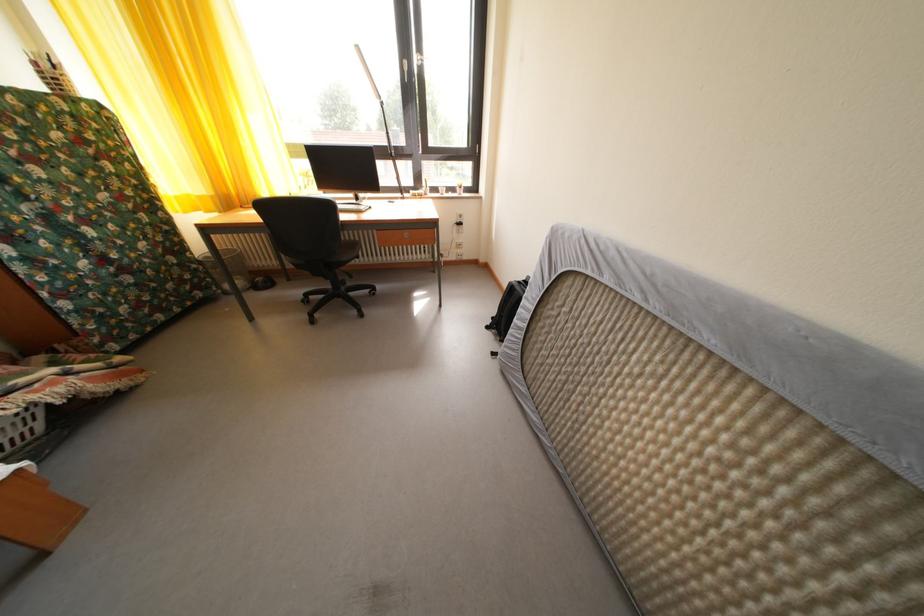
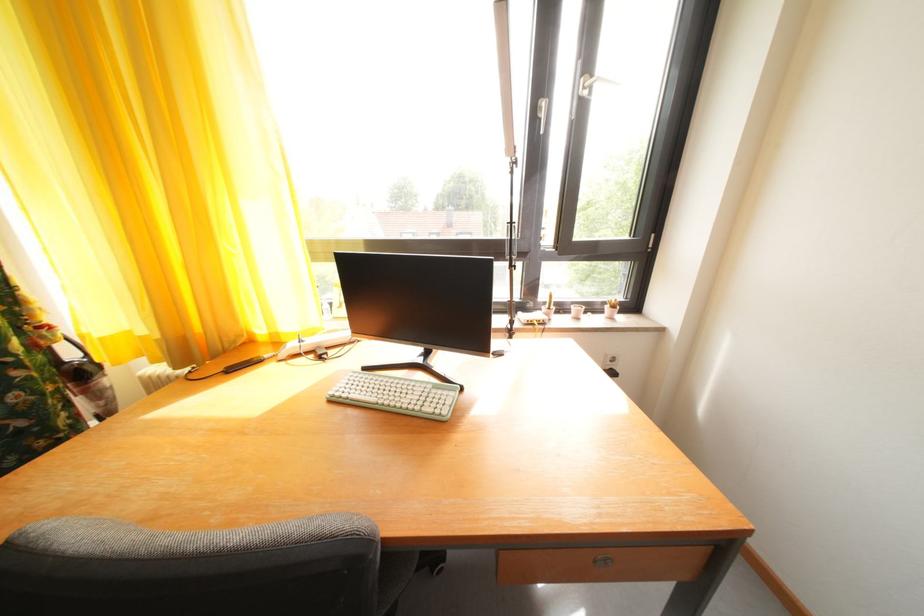
Which direction would the cameraman need to move to produce the second image?

The cameraman walked toward left, forward.